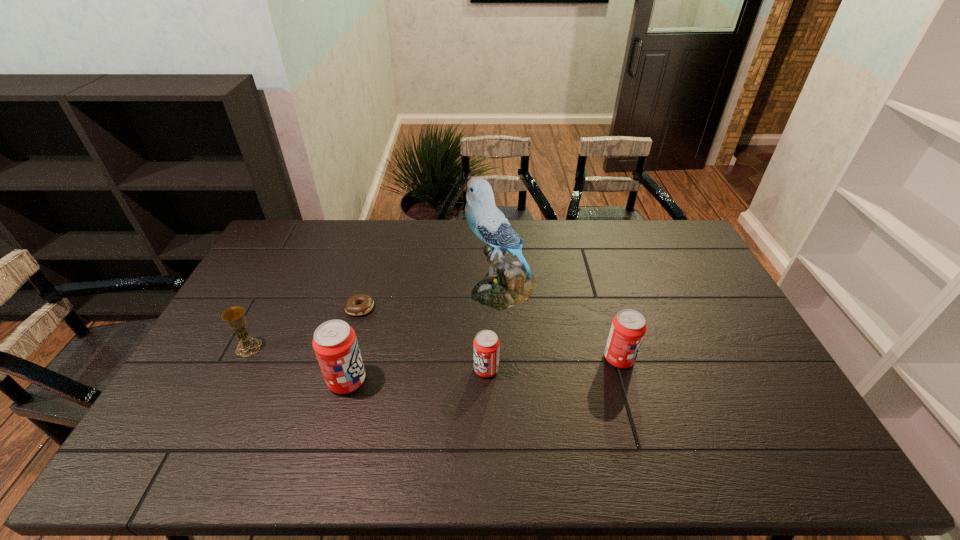
Please point a spot on the right to add another soda can. Please provide its 2D coordinates. Your answer should be formatted as a tuple, i.e. [(x, y)], where the tuple contains the x and y coordinates of a point satisfying the conditions above.

[(746, 348)]